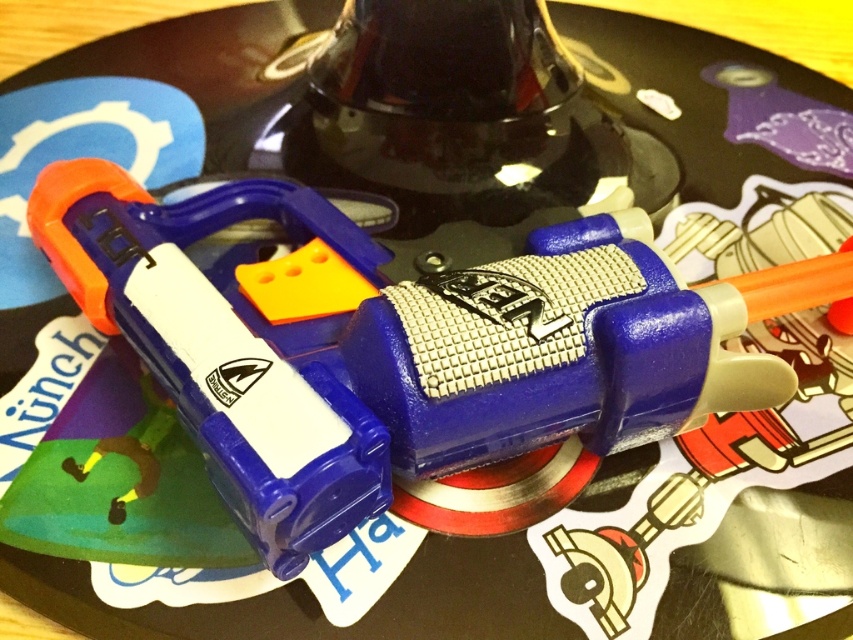
Which of these two, blue plastic toy gun at center or matte plastic toy gun at center, stands taller?

With more height is blue plastic toy gun at center.

Is blue plastic toy gun at center smaller than matte plastic toy gun at center?

No, blue plastic toy gun at center is not smaller than matte plastic toy gun at center.

Is point (142, 221) less distant than point (154, 260)?

No, (142, 221) is behind (154, 260).

This screenshot has height=640, width=853. What are the coordinates of `blue plastic toy gun at center` in the screenshot? It's located at (405, 346).